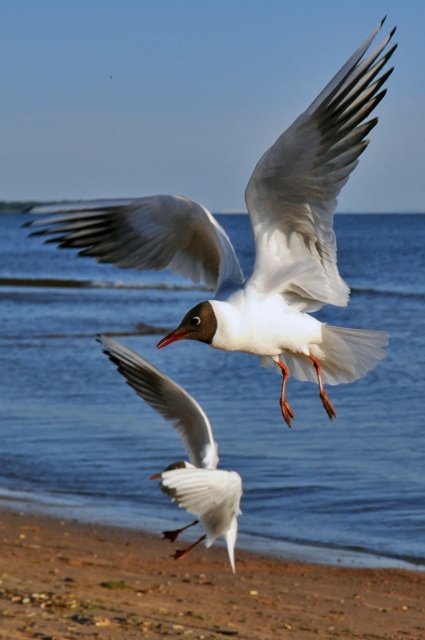
In the scene shown: Can you confirm if white feathered wing at upper center is thinner than white matte wing at upper center?

Correct, white feathered wing at upper center's width is less than white matte wing at upper center's.

Can you confirm if white feathered wing at upper center is positioned above white matte wing at upper center?

Yes.

This screenshot has height=640, width=425. Identify the location of white feathered wing at upper center. (311, 186).

Image resolution: width=425 pixels, height=640 pixels. In order to click on white feathered wing at upper center in this screenshot , I will do `click(311, 186)`.

Does white feathered wing at upper center have a lesser width compared to white matte bird at center?

Indeed, white feathered wing at upper center has a lesser width compared to white matte bird at center.

Is white feathered wing at upper center positioned at the back of white matte bird at center?

That is False.

Between point (334, 81) and point (181, 476), which one is positioned behind?

The point (181, 476) is more distant.

You are a GUI agent. You are given a task and a screenshot of the screen. Output one action in this format:
    pyautogui.click(x=<x>, y=<y>)
    Task: Click on the white feathered wing at upper center
    The width and height of the screenshot is (425, 640).
    Given the screenshot: What is the action you would take?
    pyautogui.click(x=311, y=186)

Is brown sandy beach at lower center wider than white matte bird at center?

Correct, the width of brown sandy beach at lower center exceeds that of white matte bird at center.

In order to click on brown sandy beach at lower center in this screenshot , I will do `click(186, 589)`.

Is point (405, 589) positioned in front of point (226, 534)?

No, it is not.

The width and height of the screenshot is (425, 640). In order to click on brown sandy beach at lower center in this screenshot , I will do `click(186, 589)`.